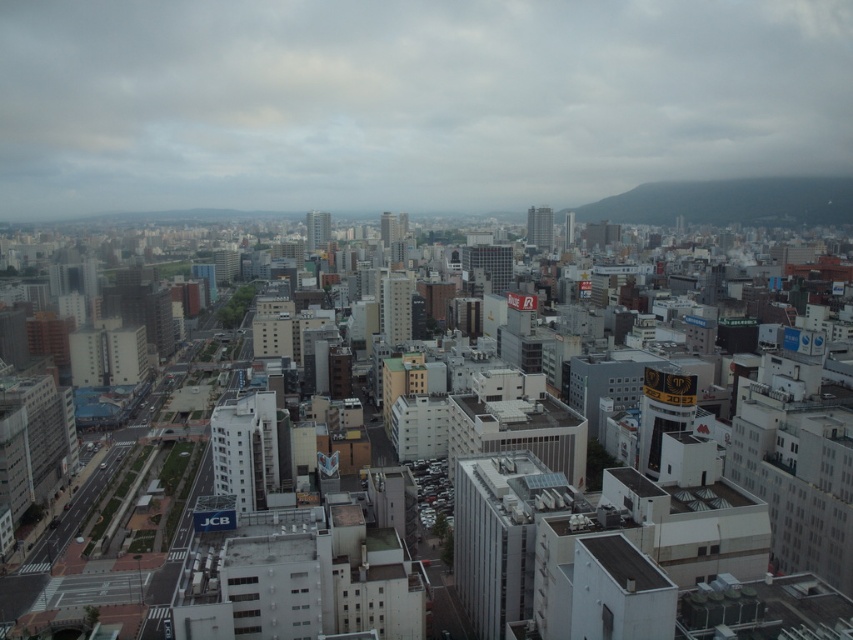
Question: Does white matte building at center appear over green grassy hill at upper right?

Choices:
 (A) no
 (B) yes

Answer: (A)

Question: Is white matte building at center below green grassy hill at upper right?

Choices:
 (A) yes
 (B) no

Answer: (A)

Question: Does white matte building at center have a smaller size compared to green grassy hill at upper right?

Choices:
 (A) yes
 (B) no

Answer: (B)

Question: Among these objects, which one is farthest from the camera?

Choices:
 (A) green grassy hill at upper right
 (B) white matte building at center

Answer: (A)

Question: Which point is farther to the camera?

Choices:
 (A) (579, 216)
 (B) (682, 438)

Answer: (A)